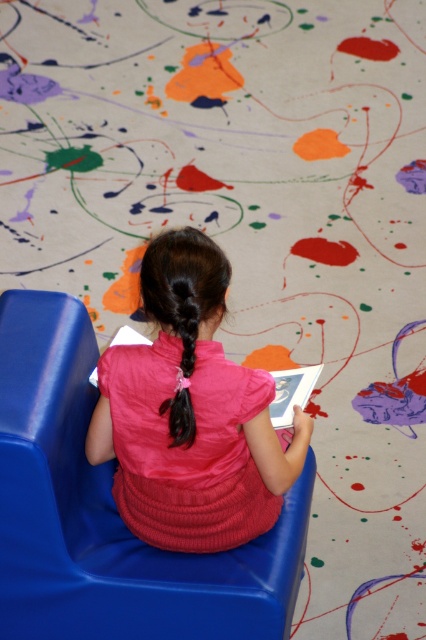
Does blue plastic chair at center have a lesser width compared to black silky hair at center?

No.

Where is `blue plastic chair at center`? The width and height of the screenshot is (426, 640). blue plastic chair at center is located at coordinates (109, 513).

Where is `blue plastic chair at center`? blue plastic chair at center is located at coordinates (109, 513).

Between blue plastic chair at center and pink satin dress at center, which one appears on the left side from the viewer's perspective?

blue plastic chair at center

Who is taller, blue plastic chair at center or pink satin dress at center?

blue plastic chair at center is taller.

Does point (25, 634) come farther from viewer compared to point (170, 465)?

That is True.

Image resolution: width=426 pixels, height=640 pixels. I want to click on blue plastic chair at center, so click(109, 513).

Is point (219, 449) in front of point (184, 394)?

That is False.

Does pink satin dress at center have a greater width compared to black silky hair at center?

Indeed, pink satin dress at center has a greater width compared to black silky hair at center.

Who is more distant from viewer, (x=238, y=461) or (x=187, y=349)?

The point (x=238, y=461) is more distant.

Where is `pink satin dress at center`? pink satin dress at center is located at coordinates (190, 413).